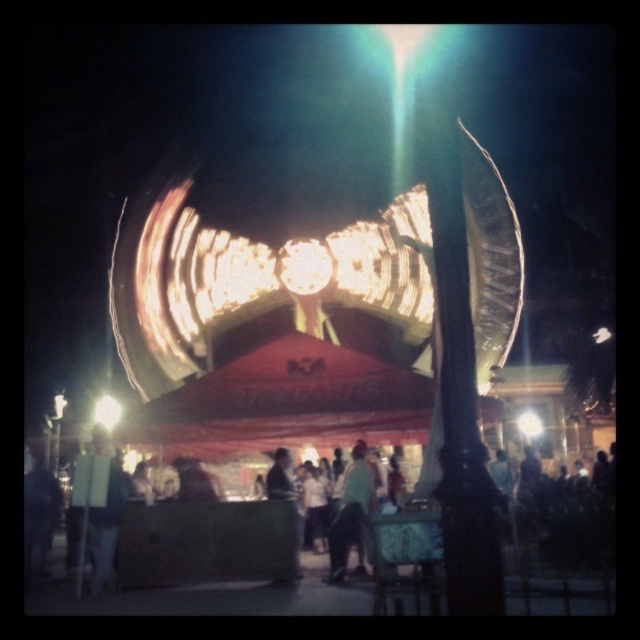
You are standing at the entrance of the fairground and see the light blue jeans at center and the bright yellow light at center. Which object is located to the left of the other?

The light blue jeans at center is positioned on the right side of bright yellow light at center, so the bright yellow light at center is to the left of the light blue jeans at center.

You are a photographer trying to capture the bright yellow light at center and the light blue jeans at center in the same frame. Which object should you focus on first if you want to ensure both are in focus?

You should focus on the light blue jeans at center first because it is larger than the bright yellow light at center, making it easier to achieve sharp focus on the larger object before adjusting for the smaller one.